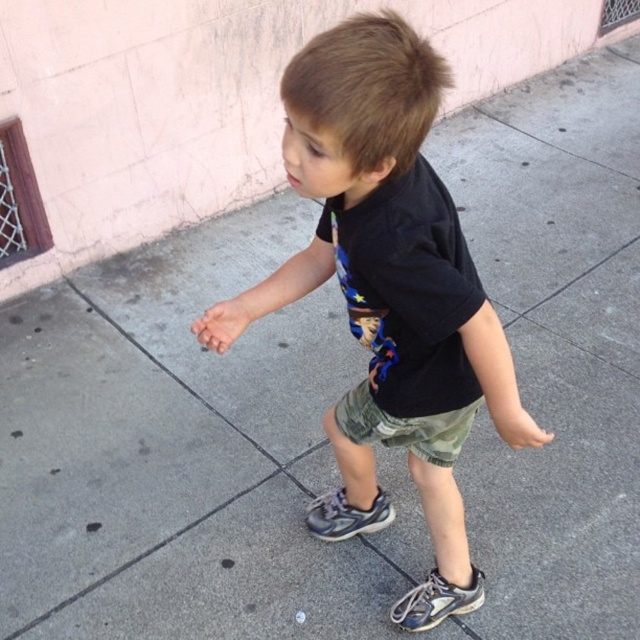
You are taking a photo of the child standing on the sidewalk. The camera is positioned at your eye level. Which of the two points, point (x=307, y=150) or point (x=348, y=509), would appear larger in the photo?

Point (x=307, y=150) is closer to the camera than point (x=348, y=509), so it would appear larger in the photo.

You are a delivery robot with a package that needs to be placed between the camo fabric shorts at center and the gray suede sneaker at center. The package is 14 inches long. Will it fit in the space between them?

The distance between the camo fabric shorts at center and the gray suede sneaker at center is 15.07 inches. Since the package is 14 inches long, it will fit in the space between them as there is enough room.

You are a fashion designer looking at the child in the image. You need to determine if the black cotton shirt at center can be paired with the gray suede sneaker at center based on their height. Can you confirm if the shirt is longer than the sneaker?

The black cotton shirt at center is taller than gray suede sneaker at center, so yes, the shirt is longer than the sneaker and can be paired together.